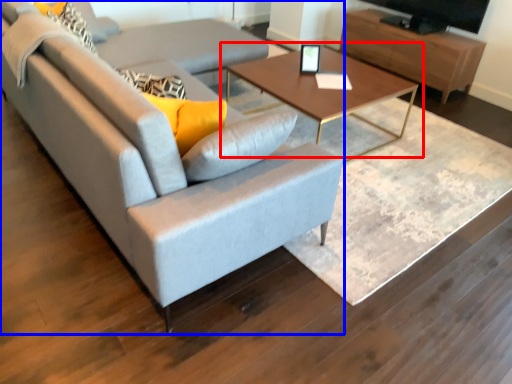
Question: Which point is further to the camera, coffee table (highlighted by a red box) or studio couch (highlighted by a blue box)?

Choices:
 (A) coffee table
 (B) studio couch

Answer: (A)